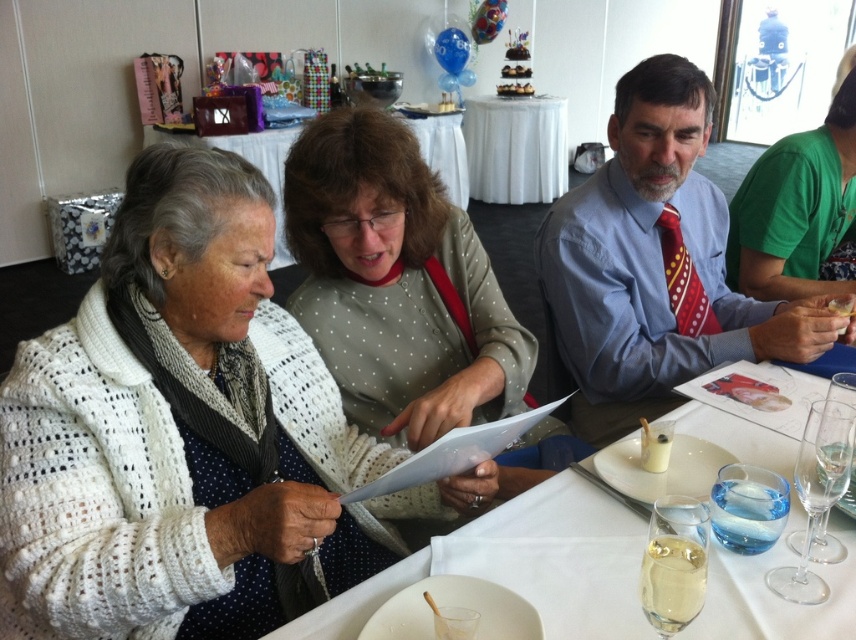
You are a photographer at the event and want to take a photo that includes both the blue shirt at center and the white paper at center. Based on their positions, which object should be placed to the left in the frame?

The white paper at center should be placed to the left in the frame because the blue shirt at center is positioned on the right side of the white paper at center.

You are a guest at the table and want to reach for the white paper at center. Based on the coordinates provided, can you estimate its position relative to your seat?

The white paper at center is located at coordinates approximately 0.839 on the x axis and 0.556 on the y axis, meaning it is positioned slightly to the right and center of the table.